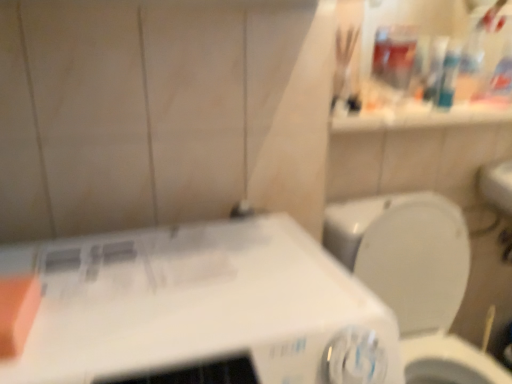
Find the location of a particular element. vacant space behind orange matte soap at left is located at coordinates (75, 269).